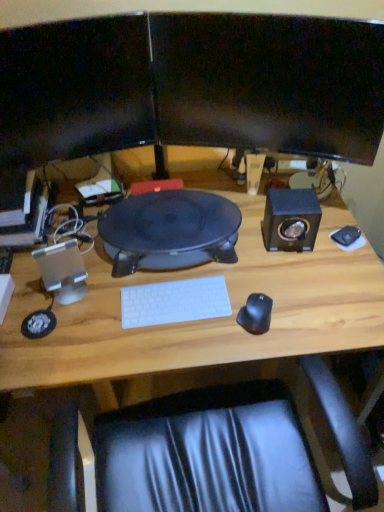
At what (x,y) coordinates should I click in order to perform the action: click on vacant space that's between black rubberized mouse at right, the 1th mouse when ordered from bottom to top, and black matte speaker at right, which is counted as the first speaker, starting from the right. Please return your answer as a coordinate pair (x, y). The image size is (384, 512). Looking at the image, I should click on (275, 277).